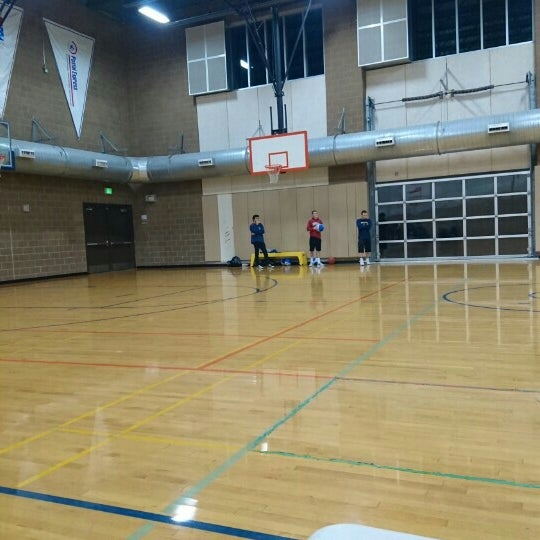
Identify the location of light. This screenshot has width=540, height=540. (148, 14).